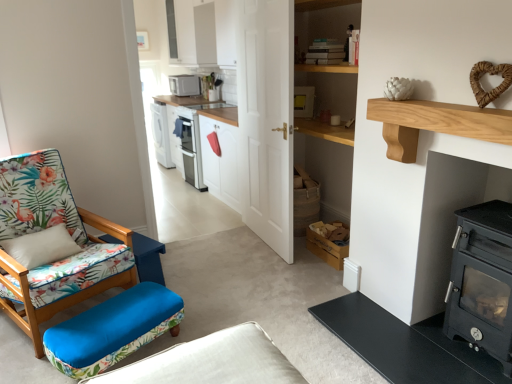
Where is `vacant space situated above blue fabric ottoman at lower left (from a real-world perspective)`? This screenshot has height=384, width=512. vacant space situated above blue fabric ottoman at lower left (from a real-world perspective) is located at coordinates (136, 239).